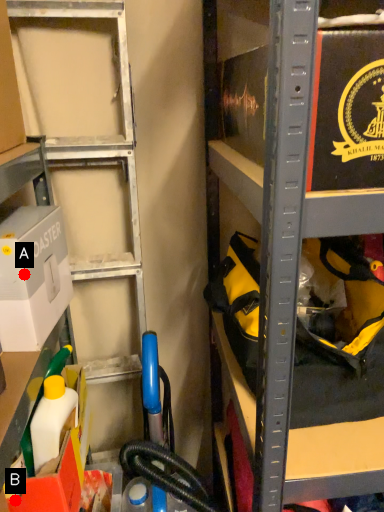
Question: Two points are circled on the image, labeled by A and B beside each circle. Which point is closer to the camera taking this photo?

Choices:
 (A) A is closer
 (B) B is closer

Answer: (A)